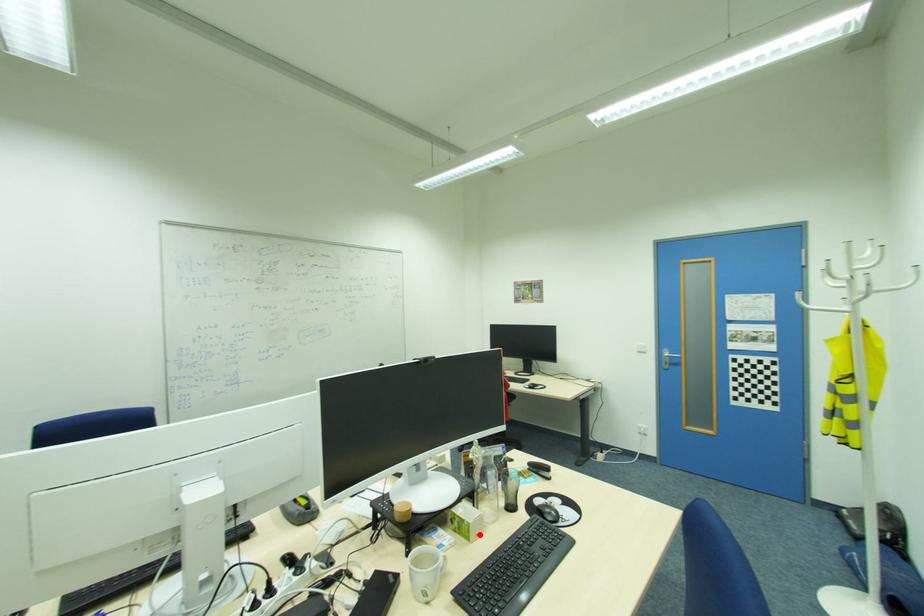
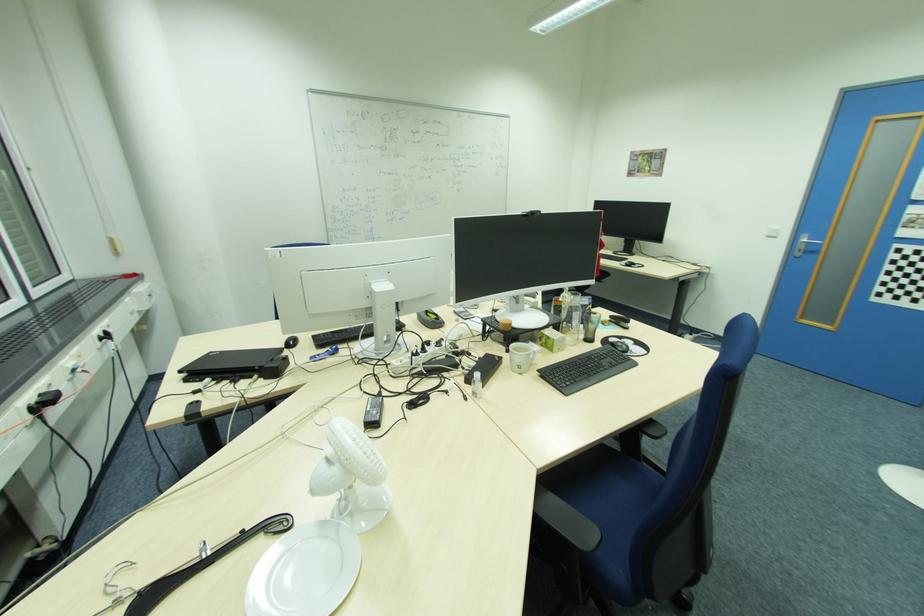
In the second image, find the point that corresponds to the highlighted location in the first image.

(562, 349)